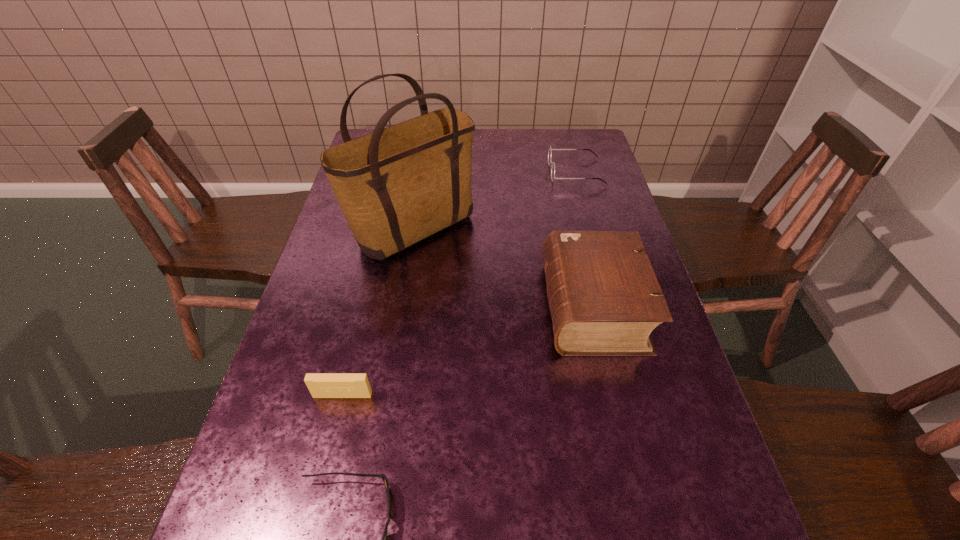
Identify the location of the tallest object. (396, 186).

Find the location of a particular element. This screenshot has width=960, height=540. the second tallest object is located at coordinates (604, 298).

Find the location of a particular element. the fourth farthest object is located at coordinates (321, 385).

Find the location of a particular element. spectacles is located at coordinates (550, 150).

Find the location of a particular element. This screenshot has height=540, width=960. vacant space located 0.090m on the back of the tote bag is located at coordinates (422, 183).

This screenshot has width=960, height=540. In order to click on vacant space located on the spine side of the Bible in this screenshot , I will do `click(486, 307)`.

Identify the location of free space located on the spine side of the Bible. The height and width of the screenshot is (540, 960). (427, 307).

I want to click on vacant space located on the spine side of the Bible, so click(x=453, y=307).

At what (x,y) coordinates should I click in order to perform the action: click on vacant region located 0.080m at the front of the second nearest object with spools. Please return your answer as a coordinate pair (x, y). This screenshot has width=960, height=540. Looking at the image, I should click on (332, 438).

Locate an element on the screen. vacant area situated on the front-facing side of the spectacles is located at coordinates (518, 172).